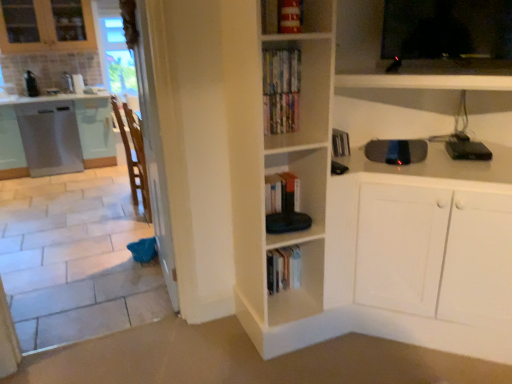
Question: Relative to hardcover books at upper center, is black glossy tv at upper right in front or behind?

Choices:
 (A) front
 (B) behind

Answer: (A)

Question: Considering the positions of black glossy tv at upper right and hardcover books at upper center in the image, is black glossy tv at upper right bigger or smaller than hardcover books at upper center?

Choices:
 (A) small
 (B) big

Answer: (B)

Question: Which object is positioned farthest from the hardcover books at upper center?

Choices:
 (A) black plastic device at upper right, arranged as the second appliance when viewed from the top
 (B) black glossy tv at upper right
 (C) satin white dishwasher at left, which is the 1th cabinetry from left to right
 (D) brown wooden chair at left
 (E) transparent plastic screen door at left

Answer: (C)

Question: Which is farther from the white tile at left?

Choices:
 (A) hardcover books at upper center
 (B) white glossy cabinet at left, placed as the 2th cabinetry when sorted from left to right
 (C) brushed metal toaster at left, the third appliance when ordered from bottom to top
 (D) satin white dishwasher at left, which appears as the 2th cabinetry when viewed from the right
 (E) black glossy tv at upper right

Answer: (C)